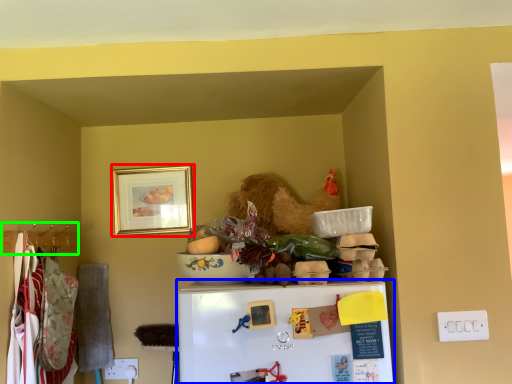
Question: Estimate the real-world distances between objects in this image. Which object is farther from picture frame (highlighted by a red box), refrigerator (highlighted by a blue box) or hanger (highlighted by a green box)?

Choices:
 (A) refrigerator
 (B) hanger

Answer: (A)